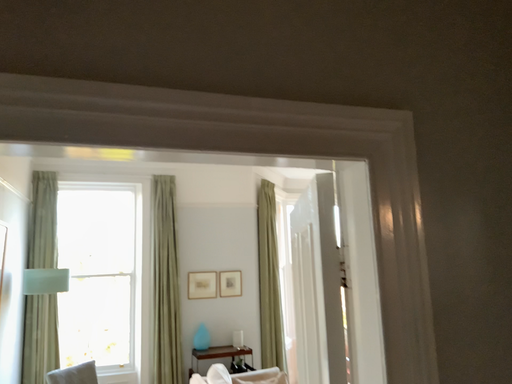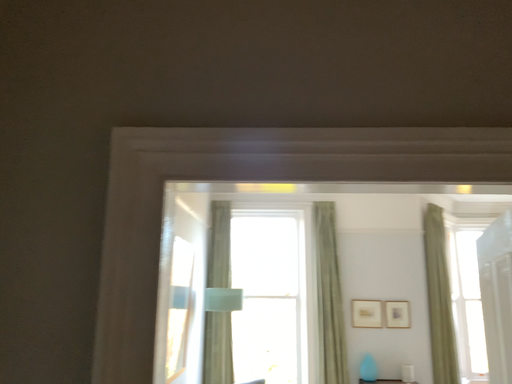
Question: How did the camera likely rotate when shooting the video?

Choices:
 (A) rotated right
 (B) rotated left

Answer: (B)